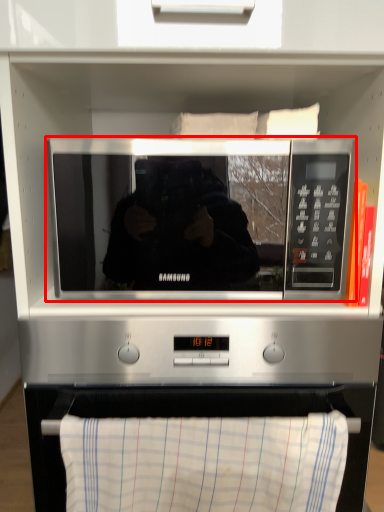
Question: From the image's perspective, where is microwave oven (annotated by the red box) located relative to cloth?

Choices:
 (A) above
 (B) below

Answer: (A)